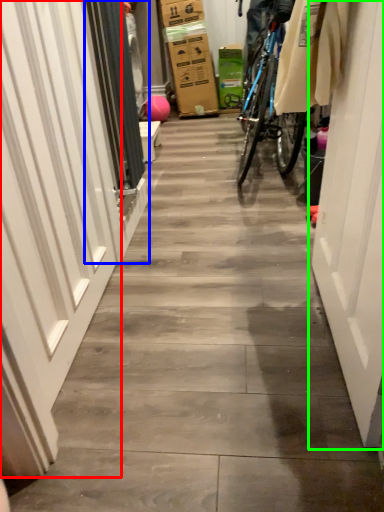
Question: Which is farther away from garage door (highlighted by a red box)? screen door (highlighted by a blue box) or door (highlighted by a green box)?

Choices:
 (A) screen door
 (B) door

Answer: (B)